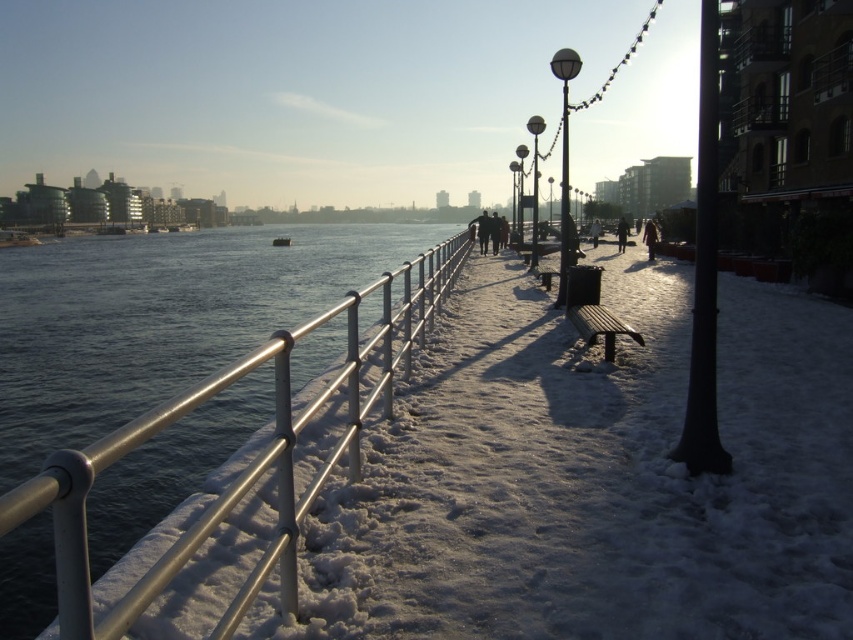
Does wooden bench at center have a lesser height compared to glossy metal lamp post at center?

Indeed, wooden bench at center has a lesser height compared to glossy metal lamp post at center.

Can you confirm if wooden bench at center is positioned above glossy metal lamp post at center?

No, wooden bench at center is not above glossy metal lamp post at center.

From the picture: Who is more forward, (x=578, y=298) or (x=521, y=180)?

Point (x=578, y=298) is in front.

At what (x,y) coordinates should I click in order to perform the action: click on wooden bench at center. Please return your answer as a coordinate pair (x, y). The image size is (853, 640). Looking at the image, I should click on (592, 308).

Does wooden bench at center have a smaller size compared to metallic pole at center?

Yes, wooden bench at center is smaller than metallic pole at center.

Between wooden bench at center and metallic pole at center, which one has less height?

Standing shorter between the two is wooden bench at center.

Is point (606, 310) more distant than point (531, 268)?

No, it is in front of (531, 268).

What are the coordinates of `wooden bench at center` in the screenshot? It's located at (592, 308).

Does black matte pole at right have a lesser width compared to satin black lamp post at upper center?

No, black matte pole at right is not thinner than satin black lamp post at upper center.

Which of these two, black matte pole at right or satin black lamp post at upper center, stands shorter?

Standing shorter between the two is black matte pole at right.

Is point (705, 388) positioned after point (563, 180)?

That is False.

Image resolution: width=853 pixels, height=640 pixels. Identify the location of black matte pole at right. (x=704, y=272).